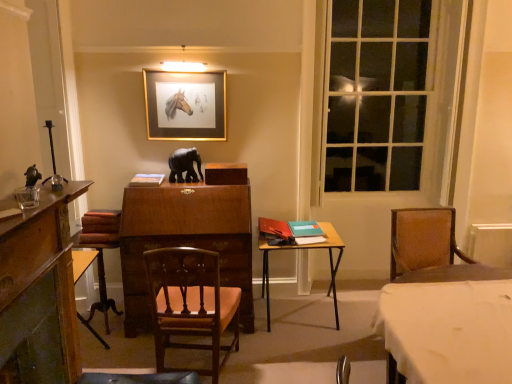
Find the location of a particular element. vacant area to the right of wooden chair at center is located at coordinates (270, 364).